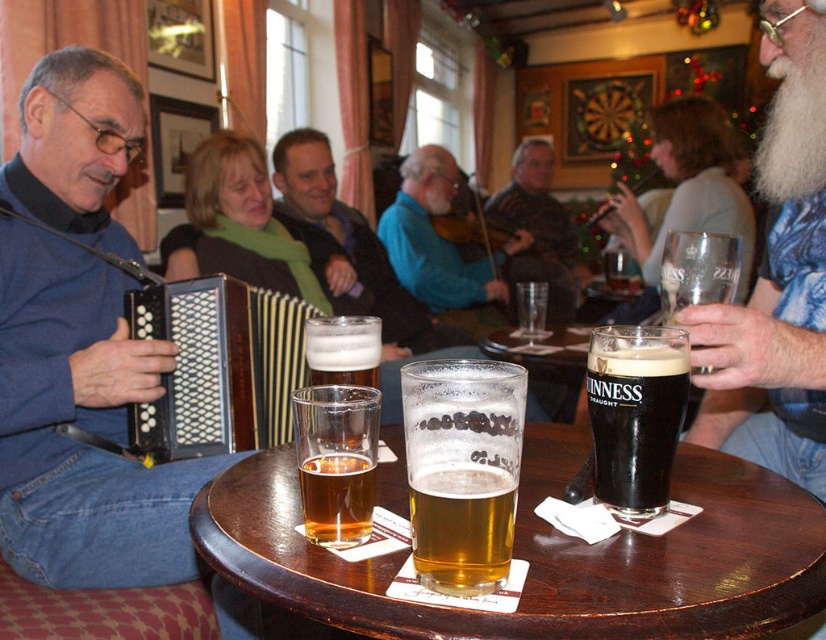
Between translucent glass at table center and clear glass at center, which one is positioned lower?

translucent glass at table center is below.

Does point (330, 532) come closer to viewer compared to point (540, 310)?

Yes, point (330, 532) is in front of point (540, 310).

Where is `translucent glass at table center`? The height and width of the screenshot is (640, 826). translucent glass at table center is located at coordinates (336, 461).

Based on the photo, is blue fabric jacket at center to the left of guinness glass at right from the viewer's perspective?

Correct, you'll find blue fabric jacket at center to the left of guinness glass at right.

Which is in front, point (392, 209) or point (727, 240)?

Point (727, 240) is in front.

In order to click on blue fabric jacket at center in this screenshot , I will do `click(437, 246)`.

Based on the photo, measure the distance from white fluffy beard at upper right to striped sweater at center.

The distance of white fluffy beard at upper right from striped sweater at center is 7.63 feet.

Does point (768, 122) come closer to viewer compared to point (533, 227)?

Yes.

The width and height of the screenshot is (826, 640). What are the coordinates of `white fluffy beard at upper right` in the screenshot? It's located at (794, 109).